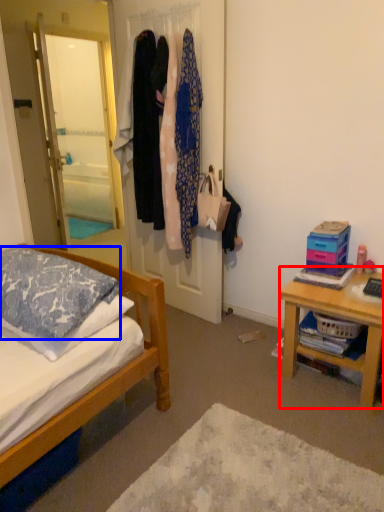
Question: Which object is further to the camera taking this photo, desk (highlighted by a red box) or pillow (highlighted by a blue box)?

Choices:
 (A) desk
 (B) pillow

Answer: (A)